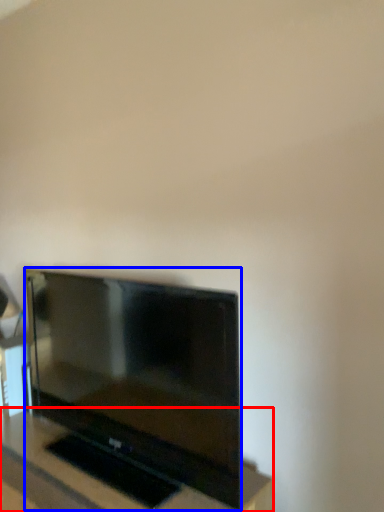
Question: Which object appears farthest to the camera in this image, furniture (highlighted by a red box) or television (highlighted by a blue box)?

Choices:
 (A) furniture
 (B) television

Answer: (B)